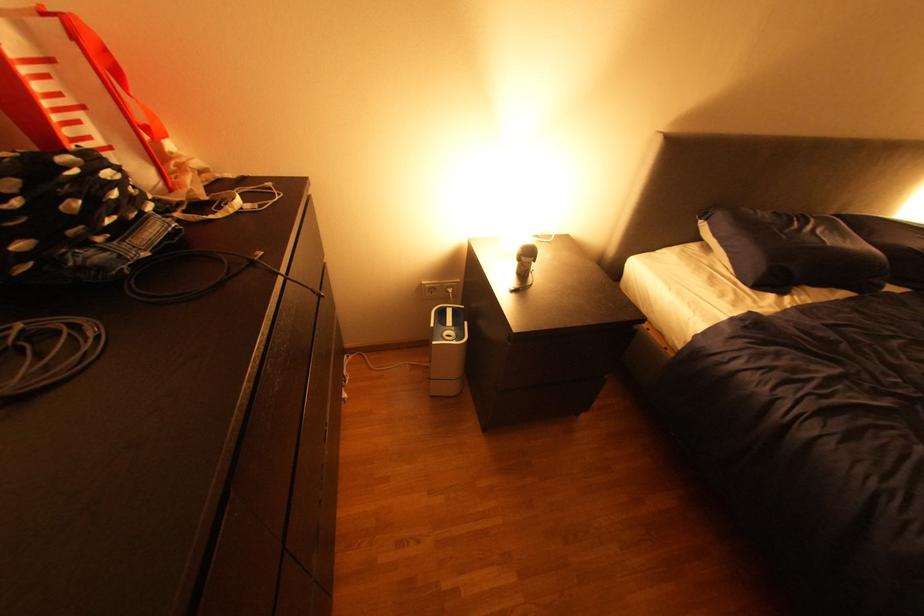
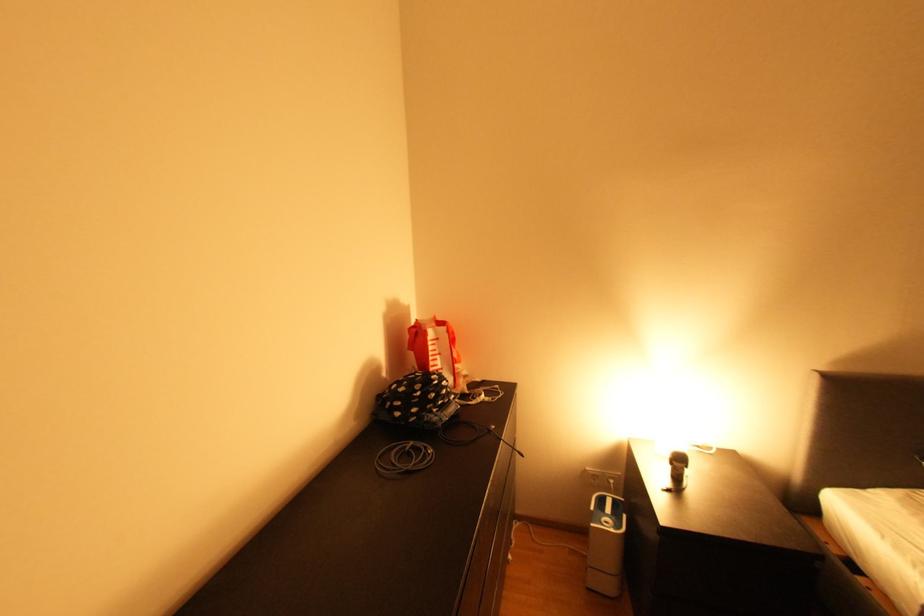
In the second image, find the point that corresponds to point (96, 244) in the first image.

(441, 411)